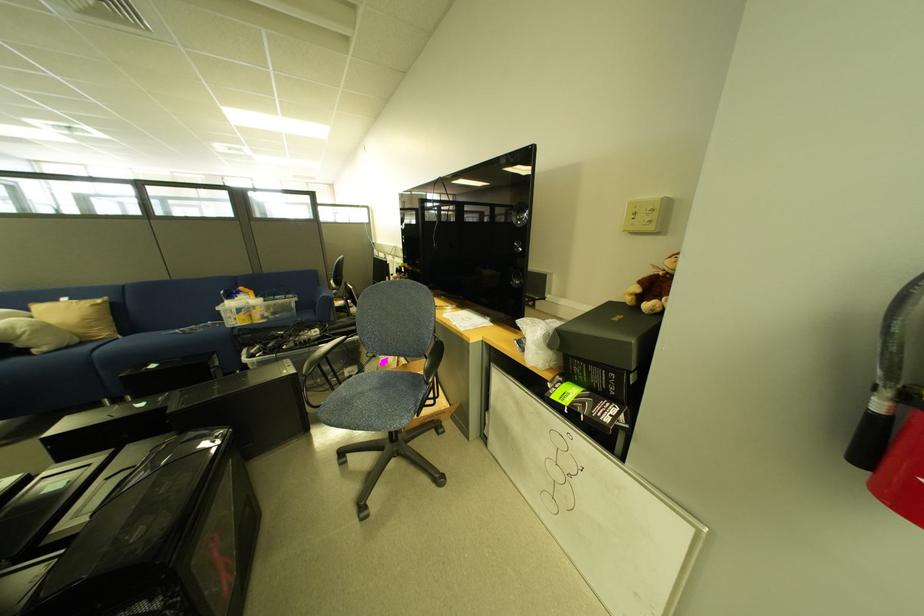
The height and width of the screenshot is (616, 924). Describe the element at coordinates (165, 347) in the screenshot. I see `a sofa sitting surface` at that location.